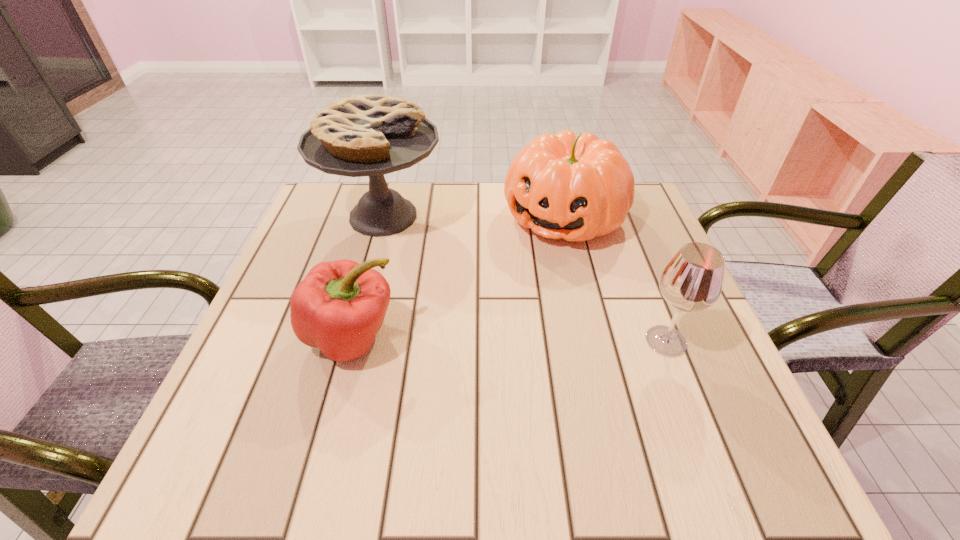
In order to click on the shortest object in this screenshot , I will do `click(339, 307)`.

Identify the location of wineglass. This screenshot has height=540, width=960. (692, 281).

Find the location of `pumpkin`. pumpkin is located at coordinates (576, 187).

Where is `pie`? Image resolution: width=960 pixels, height=540 pixels. pie is located at coordinates (371, 135).

Find the location of a particular element. Image resolution: width=960 pixels, height=540 pixels. vacant area situated on the right of the bell pepper is located at coordinates (588, 337).

Locate an element on the screen. The width and height of the screenshot is (960, 540). free location located 0.380m on the back of the wineglass is located at coordinates (615, 213).

Find the location of a particular element. This screenshot has width=960, height=540. free spot located 0.320m on the carved face of the pumpkin is located at coordinates (469, 343).

Locate an element on the screen. vacant space located 0.080m on the carved face of the pumpkin is located at coordinates (524, 270).

The height and width of the screenshot is (540, 960). In order to click on free location located on the carved face of the pumpkin in this screenshot , I will do `click(462, 354)`.

This screenshot has width=960, height=540. In order to click on vacant space located on the cut side of the tallest object in this screenshot , I will do `click(525, 326)`.